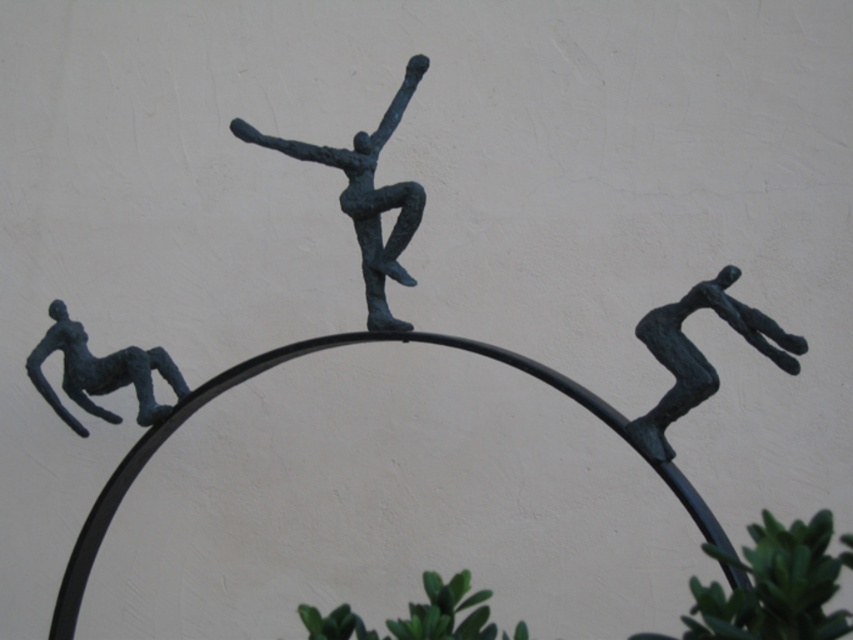
Question: Which point appears farthest from the camera in this image?

Choices:
 (A) (312, 161)
 (B) (155, 352)
 (C) (659, 444)

Answer: (B)

Question: Is the position of bronze figure at center more distant than that of bronze figure at upper right?

Choices:
 (A) yes
 (B) no

Answer: (A)

Question: Which point appears closest to the camera in this image?

Choices:
 (A) (370, 198)
 (B) (728, 304)
 (C) (61, 408)

Answer: (B)

Question: Does bronze figure at upper right appear on the left side of blue-green metal figure at lower left?

Choices:
 (A) yes
 (B) no

Answer: (B)

Question: Which point is farther from the camera taking this photo?

Choices:
 (A) (646, 426)
 (B) (413, 211)
 (C) (161, 355)

Answer: (C)

Question: Can you confirm if bronze figure at upper right is positioned below blue-green metal figure at lower left?

Choices:
 (A) yes
 (B) no

Answer: (B)